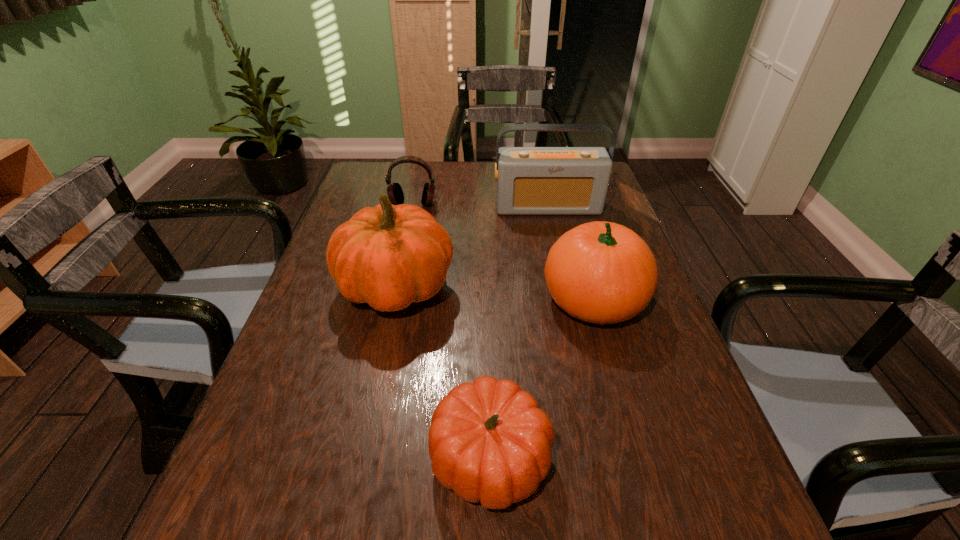
Where is `object identified as the second closest to the tallest pumpkin`? object identified as the second closest to the tallest pumpkin is located at coordinates (x=530, y=180).

Where is `object identified as the second closest to the second tallest pumpkin`? This screenshot has width=960, height=540. object identified as the second closest to the second tallest pumpkin is located at coordinates (389, 256).

Identify which pumpkin is the second closest to the headset. Please provide its 2D coordinates. Your answer should be formatted as a tuple, i.e. [(x, y)], where the tuple contains the x and y coordinates of a point satisfying the conditions above.

[(601, 272)]

The height and width of the screenshot is (540, 960). In order to click on pumpkin that stands as the closest to the nearest pumpkin in this screenshot , I will do `click(601, 272)`.

Where is `free space that satisfies the following two spatial constraints: 1. on the front-facing side of the radio receiver; 2. on the right side of the rightmost pumpkin`? Image resolution: width=960 pixels, height=540 pixels. free space that satisfies the following two spatial constraints: 1. on the front-facing side of the radio receiver; 2. on the right side of the rightmost pumpkin is located at coordinates (568, 299).

Locate an element on the screen. Image resolution: width=960 pixels, height=540 pixels. vacant space that satisfies the following two spatial constraints: 1. on the ear pads of the headset; 2. on the right side of the nearest object is located at coordinates (359, 457).

The image size is (960, 540). I want to click on vacant area that satisfies the following two spatial constraints: 1. on the ear pads of the headset; 2. on the left side of the second tallest pumpkin, so pos(393,299).

The width and height of the screenshot is (960, 540). Find the location of `free space that satisfies the following two spatial constraints: 1. on the ear pads of the headset; 2. on the left side of the tallest pumpkin`. free space that satisfies the following two spatial constraints: 1. on the ear pads of the headset; 2. on the left side of the tallest pumpkin is located at coordinates (396, 288).